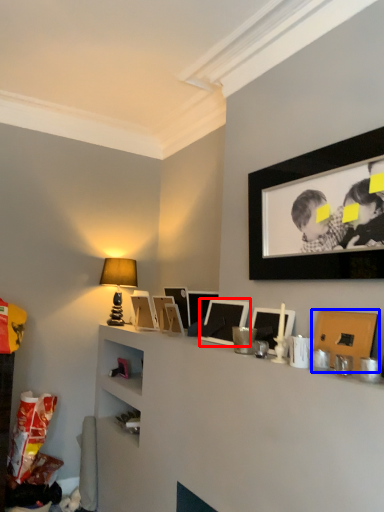
Question: Among these objects, which one is nearest to the camera, picture frame (highlighted by a red box) or picture frame (highlighted by a blue box)?

Choices:
 (A) picture frame
 (B) picture frame

Answer: (B)